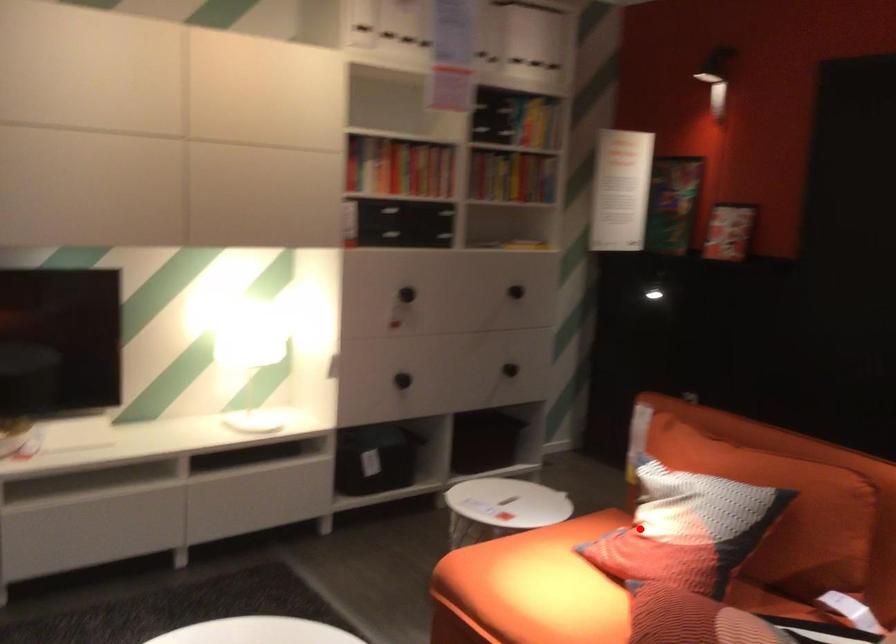
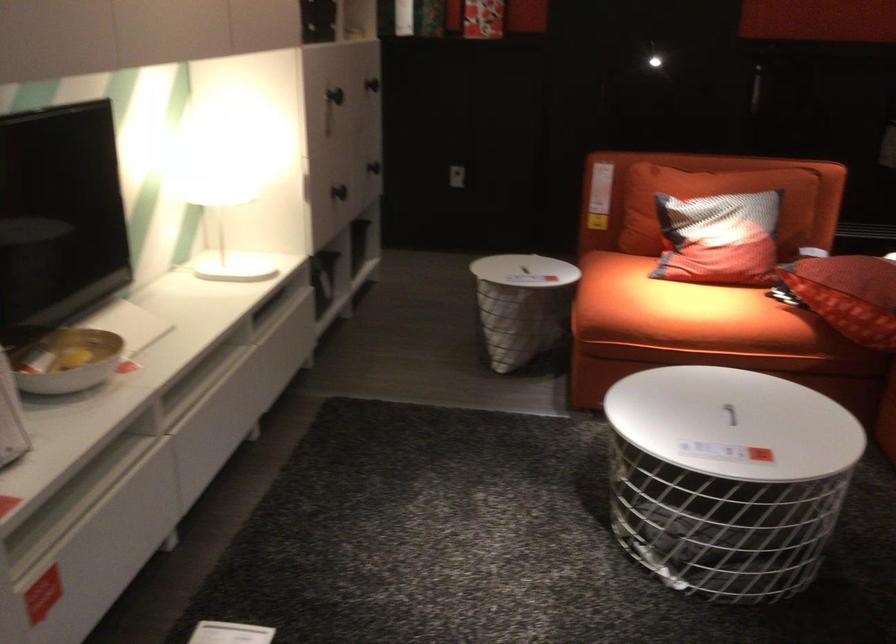
Question: I am providing you with two images of the same scene from different viewpoints. In image1, a red point is highlighted. Considering the same 3D point in image2, which of the following is correct?

Choices:
 (A) It is closer
 (B) It is farther

Answer: (B)